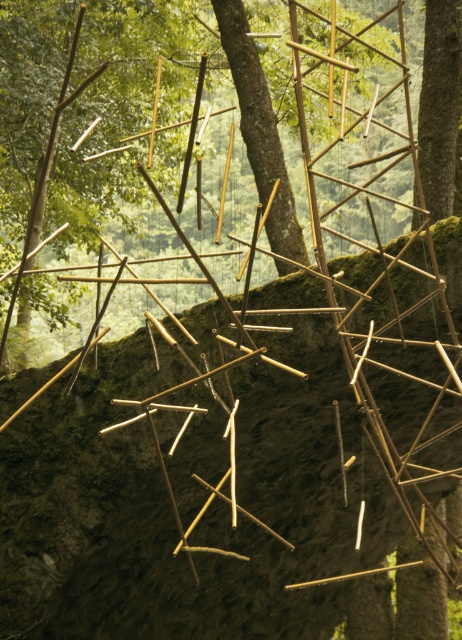
Does brown rough tree trunk at center appear on the right side of brown rough tree trunk at upper right?

In fact, brown rough tree trunk at center is to the left of brown rough tree trunk at upper right.

Between brown rough tree trunk at center and brown rough tree trunk at upper right, which one is positioned lower?

brown rough tree trunk at center is below.

Is point (249, 51) less distant than point (436, 208)?

No, (249, 51) is behind (436, 208).

At what (x,y) coordinates should I click in order to perform the action: click on brown rough tree trunk at center. Please return your answer as a coordinate pair (x, y). Image resolution: width=462 pixels, height=640 pixels. Looking at the image, I should click on (260, 129).